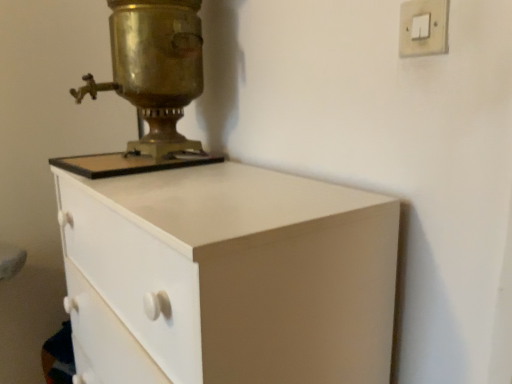
Image resolution: width=512 pixels, height=384 pixels. I want to click on spots to the right of brass/bronze metallic samovar at upper left, so tap(227, 166).